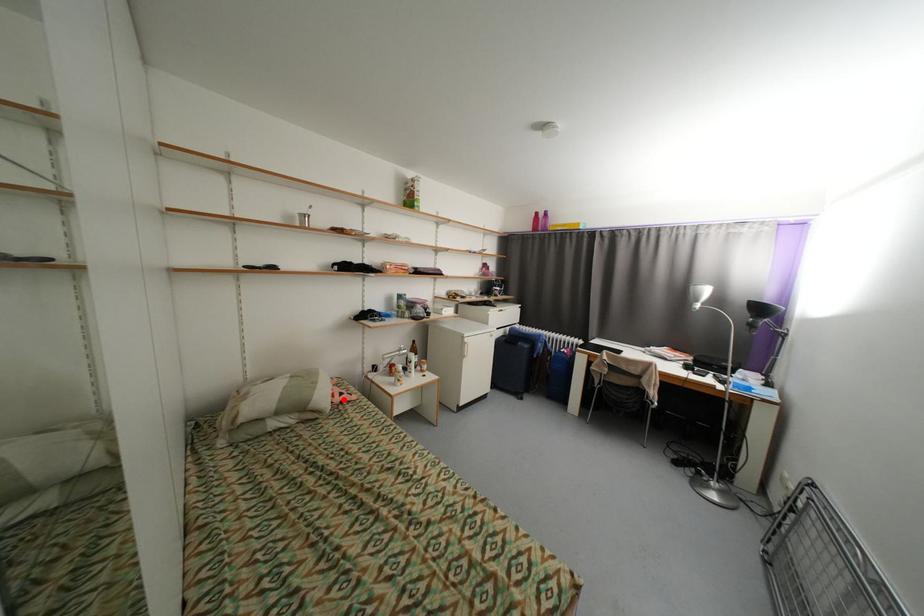
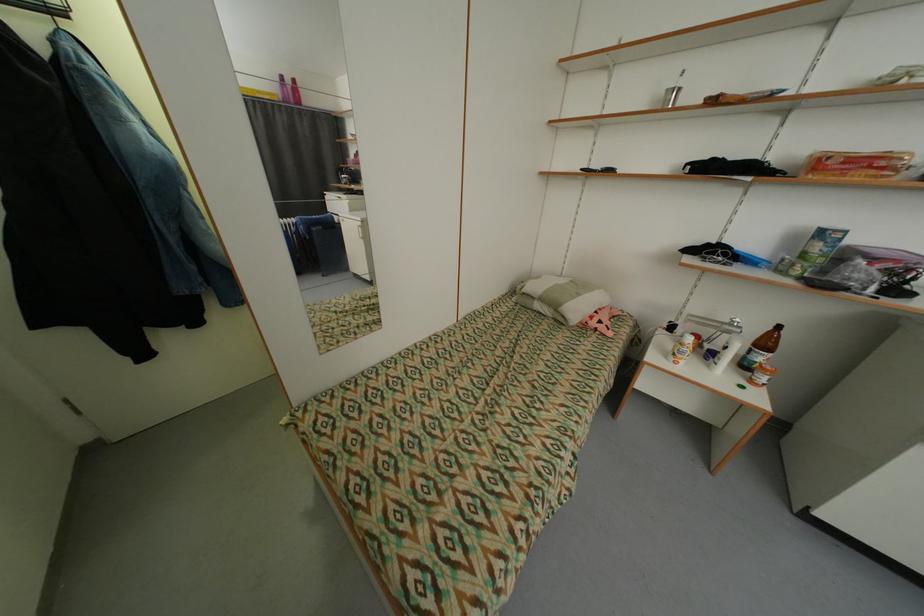
In the second image, find the point that corresponds to the highlighted location in the first image.

(600, 323)